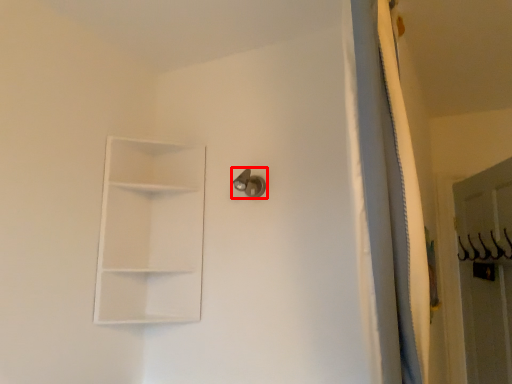
Question: From the image's perspective, considering the relative positions of door handle (annotated by the red box) and shelf in the image provided, where is door handle (annotated by the red box) located with respect to the staircase?

Choices:
 (A) above
 (B) below

Answer: (A)